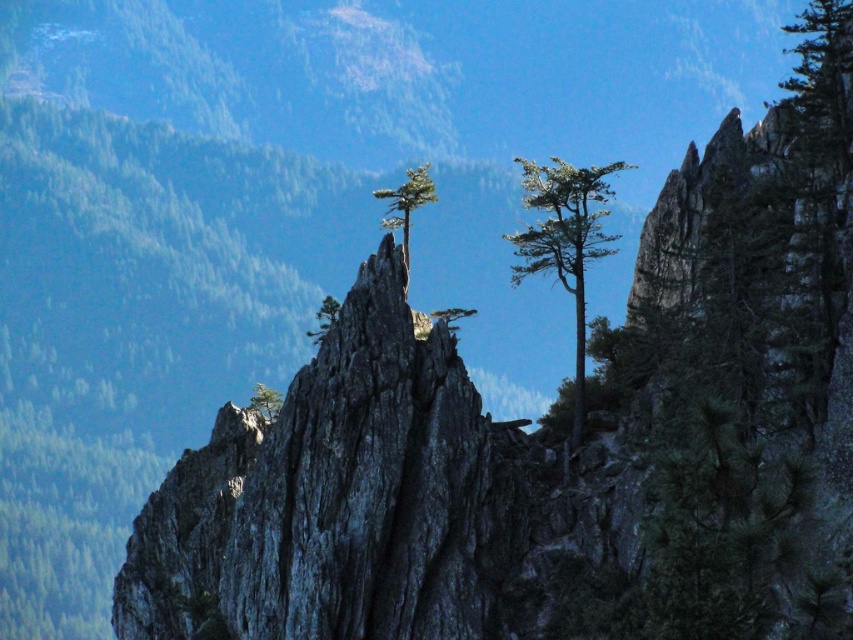
You are a hiker trying to navigate between two points in the mountainous area. You see the point labeled as point (592, 232) and the point labeled as point (379, 192). Which point is closer to you?

Point (592, 232) is closer to the viewer than point (379, 192), so the hiker should head towards point (592, 232) first as it is nearer.